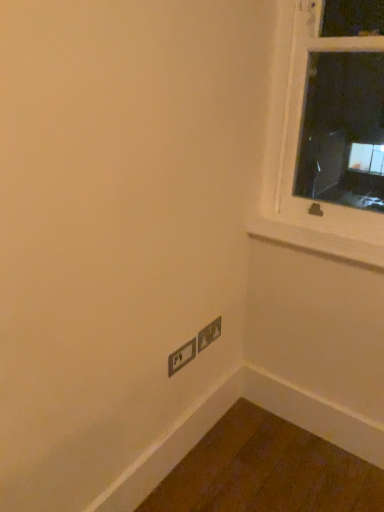
Question: From the image's perspective, is matte gray power plugs and sockets at lower right, which is the first power plugs and sockets in right-to-left order, above or below matte black power plugs and sockets at lower center, which is counted as the second power plugs and sockets, starting from the right?

Choices:
 (A) above
 (B) below

Answer: (A)

Question: Is matte gray power plugs and sockets at lower right, which ranks as the second power plugs and sockets in left-to-right order, spatially inside matte black power plugs and sockets at lower center, the 1th power plugs and sockets viewed from the left, or outside of it?

Choices:
 (A) outside
 (B) inside

Answer: (A)

Question: Which of these objects is positioned closest to the matte gray power plugs and sockets at lower right, which ranks as the second power plugs and sockets in left-to-right order?

Choices:
 (A) matte black power plugs and sockets at lower center, which is counted as the second power plugs and sockets, starting from the right
 (B) wooden at upper right

Answer: (A)

Question: Which object is the farthest from the matte black power plugs and sockets at lower center, which is counted as the second power plugs and sockets, starting from the right?

Choices:
 (A) wooden at upper right
 (B) matte gray power plugs and sockets at lower right, which ranks as the second power plugs and sockets in left-to-right order

Answer: (A)